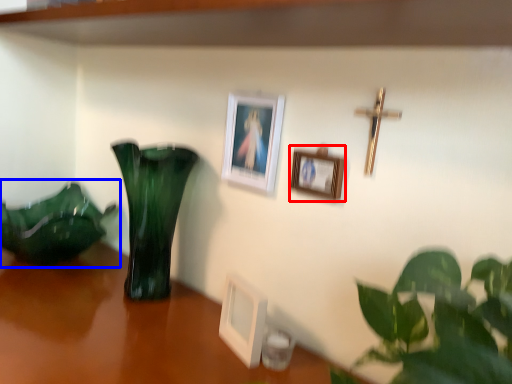
Question: Which object appears closest to the camera in this image, picture frame (highlighted by a red box) or houseplant (highlighted by a blue box)?

Choices:
 (A) picture frame
 (B) houseplant

Answer: (A)